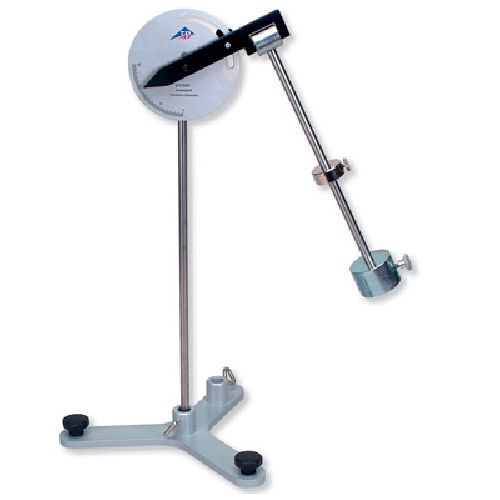
I want to click on screws, so click(x=408, y=262), click(x=347, y=166), click(x=248, y=460), click(x=73, y=420).